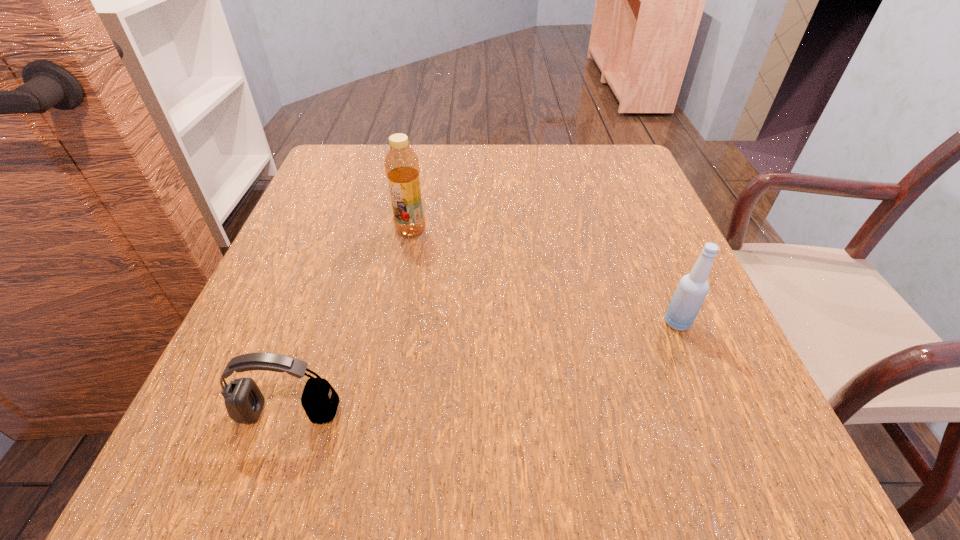
You are a GUI agent. You are given a task and a screenshot of the screen. Output one action in this format:
    pyautogui.click(x=<x>, y=<y>)
    Task: Click on the object that is at the right edge
    Image resolution: width=960 pixels, height=540 pixels.
    Given the screenshot: What is the action you would take?
    pyautogui.click(x=692, y=289)

In the image, there is a desktop. Where is `vacant space at the far edge`? This screenshot has height=540, width=960. vacant space at the far edge is located at coordinates click(x=505, y=151).

Image resolution: width=960 pixels, height=540 pixels. I want to click on vacant space at the near edge of the desktop, so click(403, 443).

In the image, there is a desktop. Identify the location of vacant space at the left edge. (355, 241).

Identify the location of free space at the right edge of the desktop. This screenshot has height=540, width=960. (641, 223).

The height and width of the screenshot is (540, 960). What are the coordinates of `vacant point at the far left corner` in the screenshot? It's located at [x=364, y=190].

Where is `free region at the near left corner`? Image resolution: width=960 pixels, height=540 pixels. free region at the near left corner is located at coordinates (202, 455).

At what (x,y) coordinates should I click in order to perform the action: click on free space at the far right corner of the desktop. Please return your answer as a coordinate pair (x, y). Looking at the image, I should click on (628, 172).

What are the coordinates of `free area in between the second object from right to left and the shortest object` in the screenshot? It's located at (349, 321).

Locate an element on the screen. The height and width of the screenshot is (540, 960). free space between the second farthest object and the headset is located at coordinates coord(483,368).